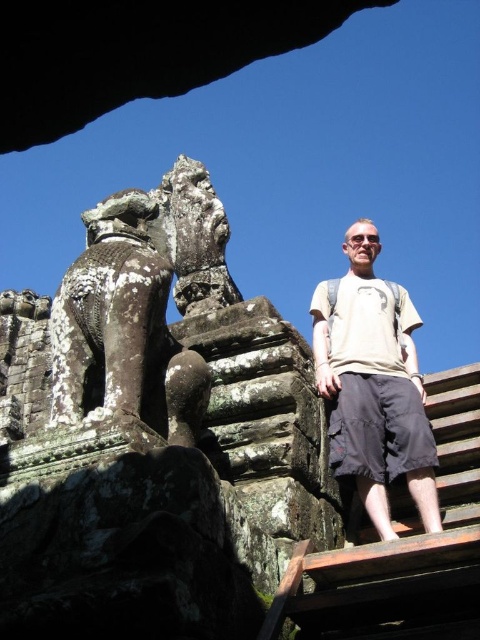
You are standing at the ancient temple and want to take a photo of the stone sculpture. You have two points marked on your map labeled as point 1 and point 2. Point 1 is at coordinates point (463, 531) and point 2 is at coordinates point (216, 248). According to the map, which point is closer to the front of the temple structure?

Point 1 is in front of point 2, so point 1 is closer to the front of the temple structure.